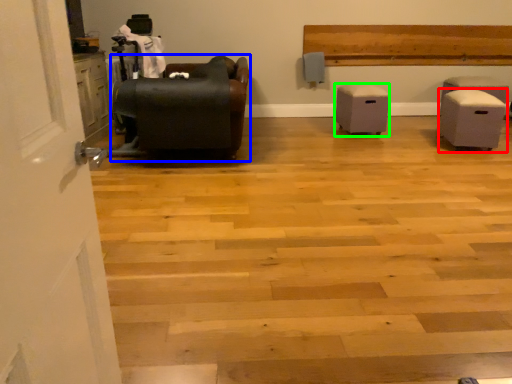
Question: Considering the real-world distances, which object is farthest from furniture (highlighted by a red box)? furniture (highlighted by a blue box) or furniture (highlighted by a green box)?

Choices:
 (A) furniture
 (B) furniture

Answer: (A)